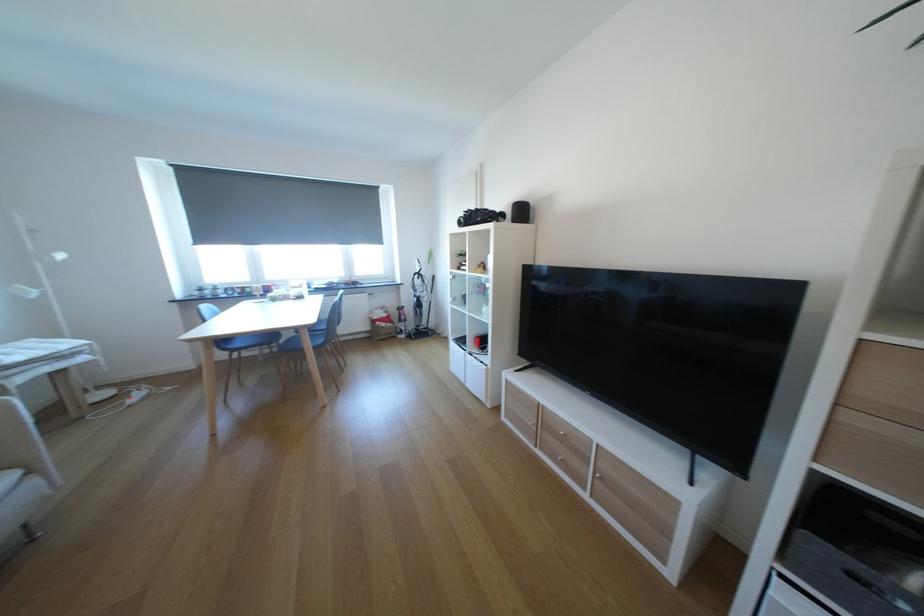
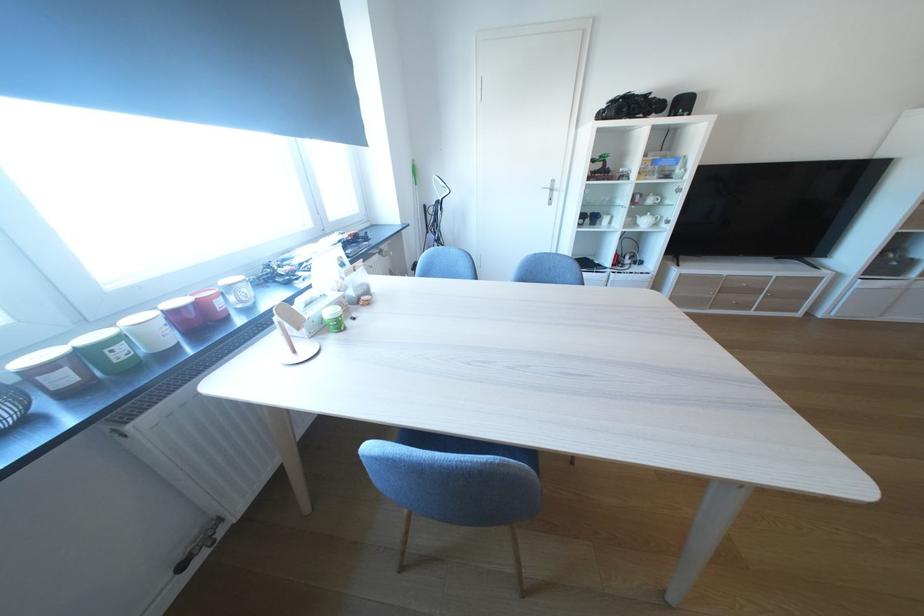
Locate, in the second image, the point that corresponds to (x=494, y=307) in the first image.

(648, 220)